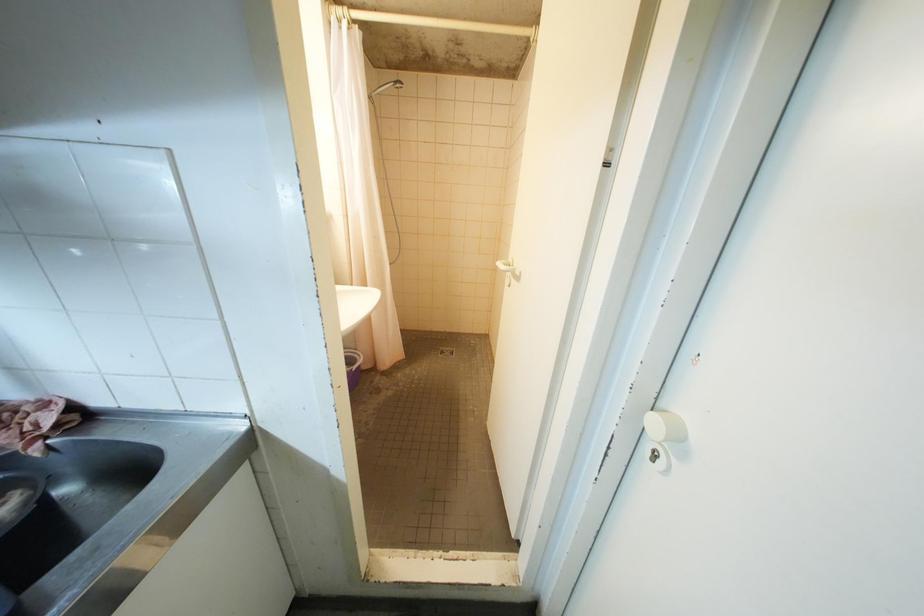
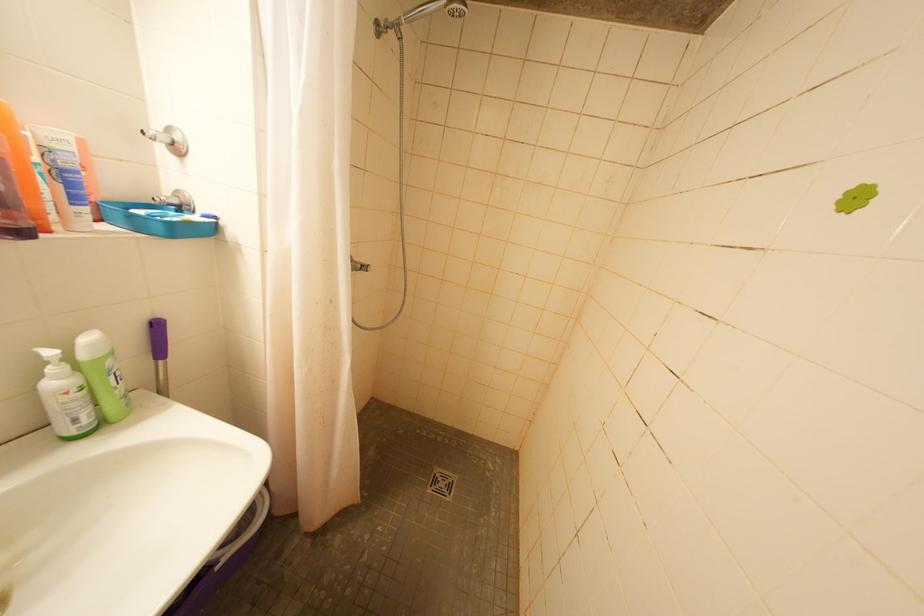
Question: The images are taken continuously from a first-person perspective. In which direction are you moving?

Choices:
 (A) Left
 (B) Right
 (C) Forward
 (D) Backward

Answer: (C)